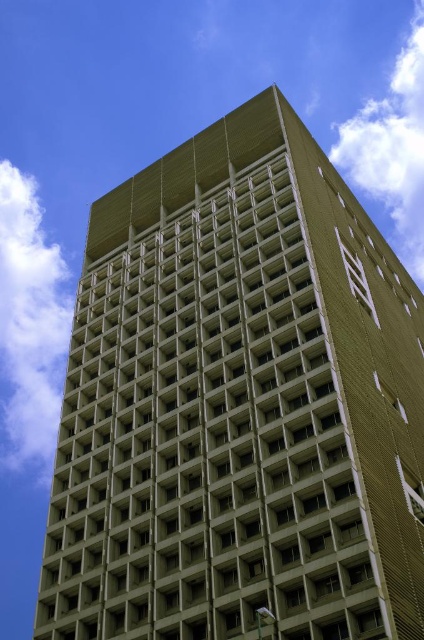
Question: Is white fluffy cloud at upper left further to camera compared to white fluffy cloud at upper center?

Choices:
 (A) no
 (B) yes

Answer: (A)

Question: Among these objects, which one is farthest from the camera?

Choices:
 (A) white fluffy cloud at upper center
 (B) white fluffy cloud at upper left

Answer: (A)

Question: Among these objects, which one is nearest to the camera?

Choices:
 (A) white fluffy cloud at upper left
 (B) white fluffy cloud at upper center

Answer: (A)

Question: Is white fluffy cloud at upper left thinner than white fluffy cloud at upper center?

Choices:
 (A) yes
 (B) no

Answer: (A)

Question: Observing the image, what is the correct spatial positioning of white fluffy cloud at upper left in reference to white fluffy cloud at upper center?

Choices:
 (A) below
 (B) above

Answer: (A)